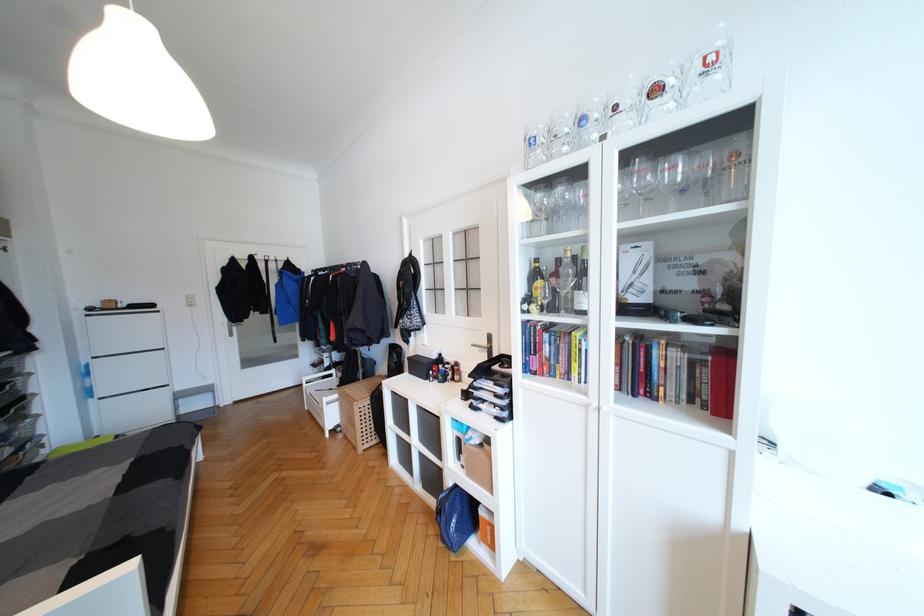
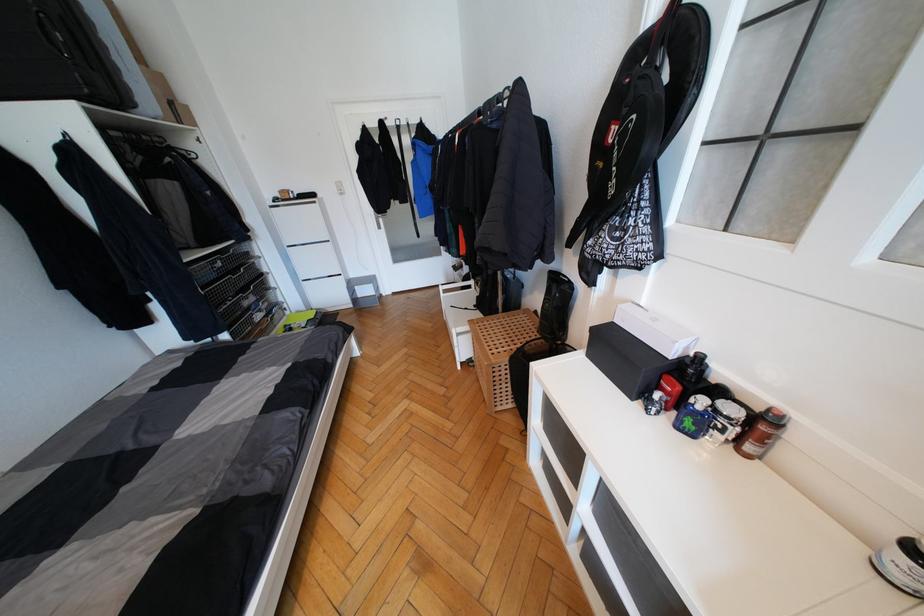
Locate, in the second image, the point that corresponds to the point at 458,369 in the first image.

(767, 429)